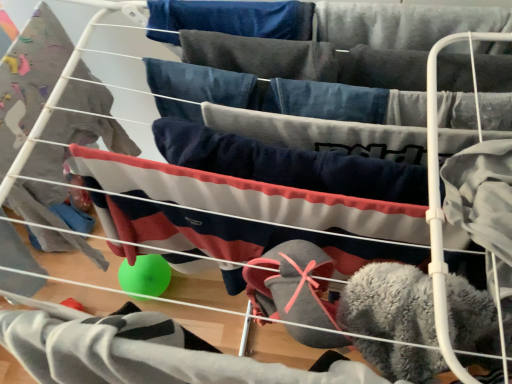
The height and width of the screenshot is (384, 512). Find the location of `fuzzy gray socks at lower center, acting as the first clothing starting from the bottom`. fuzzy gray socks at lower center, acting as the first clothing starting from the bottom is located at coordinates (141, 352).

The width and height of the screenshot is (512, 384). Describe the element at coordinates (141, 352) in the screenshot. I see `fuzzy gray socks at lower center, acting as the first clothing starting from the bottom` at that location.

What do you see at coordinates (288, 164) in the screenshot? The width and height of the screenshot is (512, 384). I see `navy blue fleece pants at center, which is counted as the first clothing, starting from the top` at bounding box center [288, 164].

Find the location of a particular element. The width and height of the screenshot is (512, 384). navy blue fleece pants at center, which is the 2th clothing from bottom to top is located at coordinates (288, 164).

Image resolution: width=512 pixels, height=384 pixels. I want to click on fuzzy gray socks at lower center, acting as the first clothing starting from the bottom, so click(141, 352).

Does navy blue fleece pants at center, which is the 2th clothing from bottom to top, appear on the left side of fuzzy gray socks at lower center, acting as the first clothing starting from the bottom?

No.

Is navy blue fleece pants at center, which is the 2th clothing from bottom to top, further to camera compared to fuzzy gray socks at lower center, acting as the first clothing starting from the bottom?

Yes, the depth of navy blue fleece pants at center, which is the 2th clothing from bottom to top, is greater than that of fuzzy gray socks at lower center, acting as the first clothing starting from the bottom.

Considering the points (383, 199) and (48, 342), which point is in front, point (383, 199) or point (48, 342)?

The point (48, 342) is in front.

Based on the photo, from the image's perspective, is navy blue fleece pants at center, which is the 2th clothing from bottom to top, located above fuzzy gray socks at lower center, the second clothing in the top-to-bottom sequence?

Correct, navy blue fleece pants at center, which is the 2th clothing from bottom to top, appears higher than fuzzy gray socks at lower center, the second clothing in the top-to-bottom sequence, in the image.

From a real-world perspective, is navy blue fleece pants at center, which is the 2th clothing from bottom to top, located beneath fuzzy gray socks at lower center, the second clothing in the top-to-bottom sequence?

Actually, navy blue fleece pants at center, which is the 2th clothing from bottom to top, is physically above fuzzy gray socks at lower center, the second clothing in the top-to-bottom sequence, in the real world.

Can you confirm if navy blue fleece pants at center, which is the 2th clothing from bottom to top, is thinner than fuzzy gray socks at lower center, acting as the first clothing starting from the bottom?

Correct, the width of navy blue fleece pants at center, which is the 2th clothing from bottom to top, is less than that of fuzzy gray socks at lower center, acting as the first clothing starting from the bottom.

Who is shorter, navy blue fleece pants at center, which is the 2th clothing from bottom to top, or fuzzy gray socks at lower center, the second clothing in the top-to-bottom sequence?

navy blue fleece pants at center, which is the 2th clothing from bottom to top, is shorter.

Which of these two, navy blue fleece pants at center, which is counted as the first clothing, starting from the top, or fuzzy gray socks at lower center, the second clothing in the top-to-bottom sequence, is smaller?

Smaller between the two is navy blue fleece pants at center, which is counted as the first clothing, starting from the top.

Does navy blue fleece pants at center, which is the 2th clothing from bottom to top, contain fuzzy gray socks at lower center, acting as the first clothing starting from the bottom?

No, fuzzy gray socks at lower center, acting as the first clothing starting from the bottom, is not inside navy blue fleece pants at center, which is the 2th clothing from bottom to top.

Would you say navy blue fleece pants at center, which is the 2th clothing from bottom to top, is a long distance from fuzzy gray socks at lower center, acting as the first clothing starting from the bottom?

No.

Could you tell me if navy blue fleece pants at center, which is counted as the first clothing, starting from the top, is turned towards fuzzy gray socks at lower center, acting as the first clothing starting from the bottom?

Yes.

How many degrees apart are the facing directions of navy blue fleece pants at center, which is the 2th clothing from bottom to top, and fuzzy gray socks at lower center, acting as the first clothing starting from the bottom?

They differ by 0.00635 degrees in their facing directions.

The image size is (512, 384). What are the coordinates of `clothing that appears above the fuzzy gray socks at lower center, acting as the first clothing starting from the bottom (from a real-world perspective)` in the screenshot? It's located at (288, 164).

Would you say fuzzy gray socks at lower center, the second clothing in the top-to-bottom sequence, is to the left or to the right of navy blue fleece pants at center, which is counted as the first clothing, starting from the top, in the picture?

In the image, fuzzy gray socks at lower center, the second clothing in the top-to-bottom sequence, appears on the left side of navy blue fleece pants at center, which is counted as the first clothing, starting from the top.

Between fuzzy gray socks at lower center, acting as the first clothing starting from the bottom, and navy blue fleece pants at center, which is the 2th clothing from bottom to top, which one is positioned in front?

fuzzy gray socks at lower center, acting as the first clothing starting from the bottom, is more forward.

Is point (362, 378) positioned behind point (169, 136)?

No.

Based on the photo, from the image's perspective, is fuzzy gray socks at lower center, acting as the first clothing starting from the bottom, located above or below navy blue fleece pants at center, which is the 2th clothing from bottom to top?

Based on their image positions, fuzzy gray socks at lower center, acting as the first clothing starting from the bottom, is located beneath navy blue fleece pants at center, which is the 2th clothing from bottom to top.

From a real-world perspective, between fuzzy gray socks at lower center, acting as the first clothing starting from the bottom, and navy blue fleece pants at center, which is the 2th clothing from bottom to top, who is vertically lower?

fuzzy gray socks at lower center, acting as the first clothing starting from the bottom.

Is fuzzy gray socks at lower center, the second clothing in the top-to-bottom sequence, thinner than navy blue fleece pants at center, which is the 2th clothing from bottom to top?

No.

Considering the relative sizes of fuzzy gray socks at lower center, the second clothing in the top-to-bottom sequence, and navy blue fleece pants at center, which is counted as the first clothing, starting from the top, in the image provided, is fuzzy gray socks at lower center, the second clothing in the top-to-bottom sequence, taller than navy blue fleece pants at center, which is counted as the first clothing, starting from the top,?

Correct, fuzzy gray socks at lower center, the second clothing in the top-to-bottom sequence, is much taller as navy blue fleece pants at center, which is counted as the first clothing, starting from the top.

Does fuzzy gray socks at lower center, the second clothing in the top-to-bottom sequence, have a smaller size compared to navy blue fleece pants at center, which is counted as the first clothing, starting from the top?

No, fuzzy gray socks at lower center, the second clothing in the top-to-bottom sequence, is not smaller than navy blue fleece pants at center, which is counted as the first clothing, starting from the top.

Would you say fuzzy gray socks at lower center, the second clothing in the top-to-bottom sequence, is outside navy blue fleece pants at center, which is counted as the first clothing, starting from the top?

That's correct, fuzzy gray socks at lower center, the second clothing in the top-to-bottom sequence, is outside of navy blue fleece pants at center, which is counted as the first clothing, starting from the top.

Is fuzzy gray socks at lower center, acting as the first clothing starting from the bottom, touching navy blue fleece pants at center, which is counted as the first clothing, starting from the top?

No.

Could you tell me if fuzzy gray socks at lower center, the second clothing in the top-to-bottom sequence, is facing navy blue fleece pants at center, which is counted as the first clothing, starting from the top?

No, fuzzy gray socks at lower center, the second clothing in the top-to-bottom sequence, is not turned towards navy blue fleece pants at center, which is counted as the first clothing, starting from the top.

Locate an element on the screen. This screenshot has height=384, width=512. clothing in front of the navy blue fleece pants at center, which is the 2th clothing from bottom to top is located at coordinates (141, 352).

You are a GUI agent. You are given a task and a screenshot of the screen. Output one action in this format:
    pyautogui.click(x=<x>, y=<y>)
    Task: Click on the clothing located underneath the navy blue fleece pants at center, which is the 2th clothing from bottom to top (from a real-world perspective)
    
    Given the screenshot: What is the action you would take?
    pyautogui.click(x=141, y=352)

At what (x,y) coordinates should I click in order to perform the action: click on clothing that appears on the left of navy blue fleece pants at center, which is the 2th clothing from bottom to top. Please return your answer as a coordinate pair (x, y). Looking at the image, I should click on (141, 352).